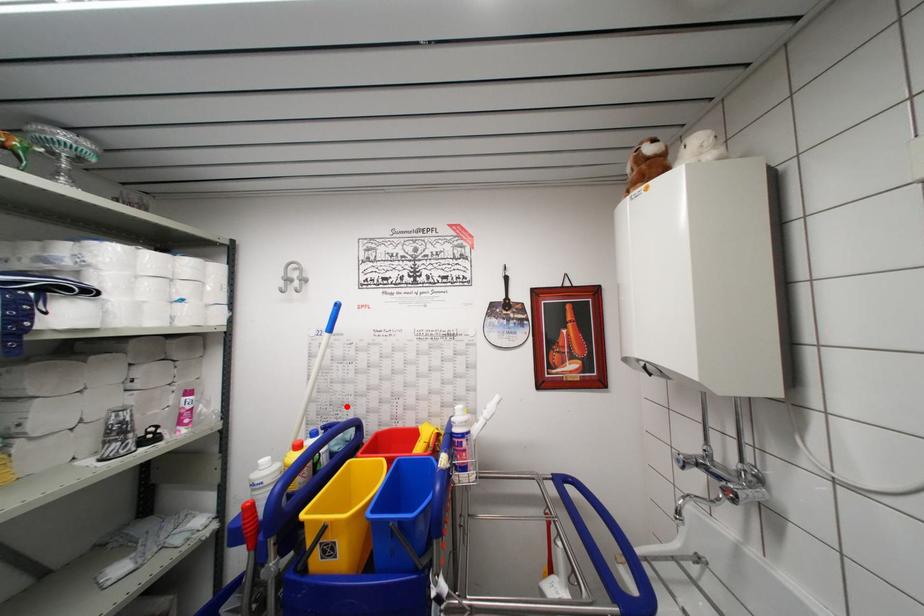
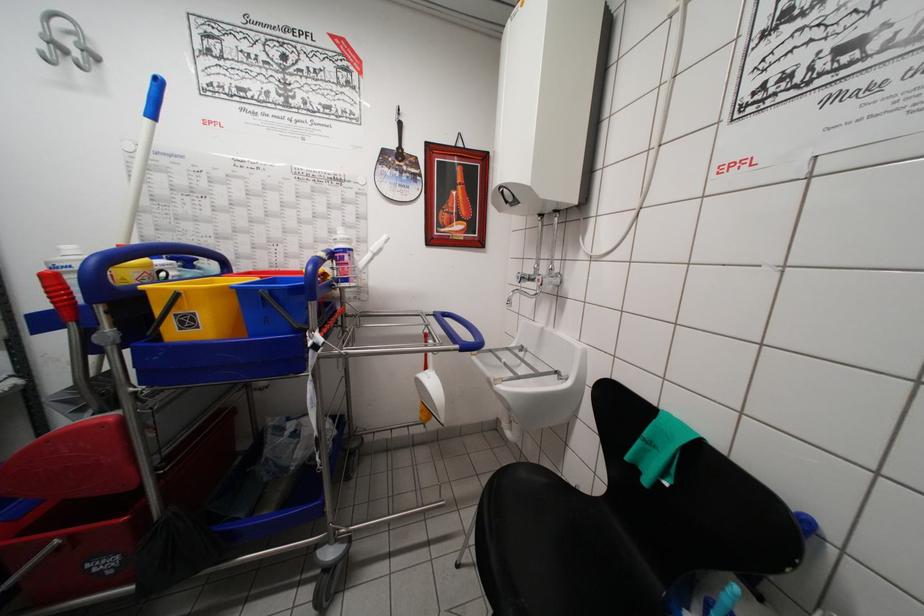
Find the pixel in the second image that matches the highlighted location in the first image.

(203, 249)